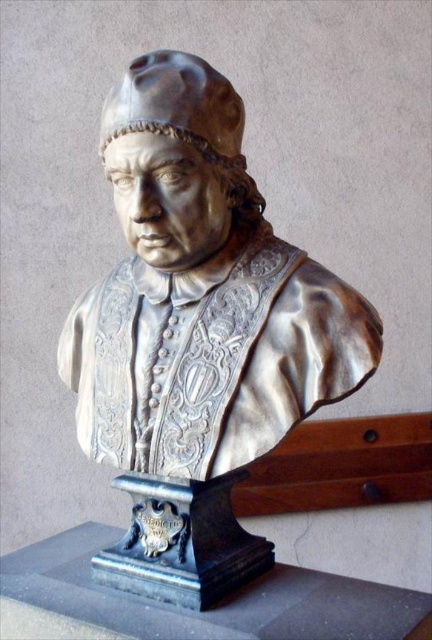
Question: Is shiny bronze bust at center to the right of matte silver skull at center from the viewer's perspective?

Choices:
 (A) no
 (B) yes

Answer: (B)

Question: Can you confirm if shiny bronze bust at center is positioned above matte silver skull at center?

Choices:
 (A) no
 (B) yes

Answer: (A)

Question: Is shiny bronze bust at center thinner than matte silver skull at center?

Choices:
 (A) yes
 (B) no

Answer: (B)

Question: Which point is closer to the camera taking this photo?

Choices:
 (A) (228, 212)
 (B) (104, 356)

Answer: (A)

Question: Which point is closer to the camera?

Choices:
 (A) matte silver skull at center
 (B) shiny bronze bust at center

Answer: (B)